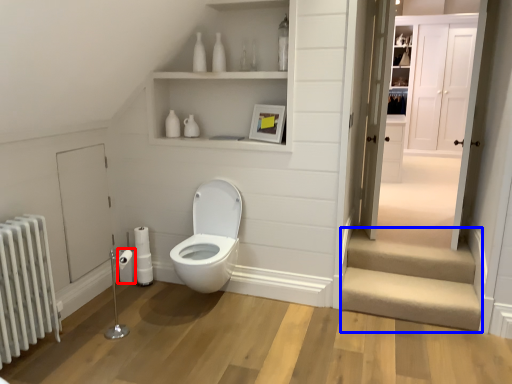
Question: Among these objects, which one is farthest to the camera, toilet paper (highlighted by a red box) or stairwell (highlighted by a blue box)?

Choices:
 (A) toilet paper
 (B) stairwell

Answer: (A)